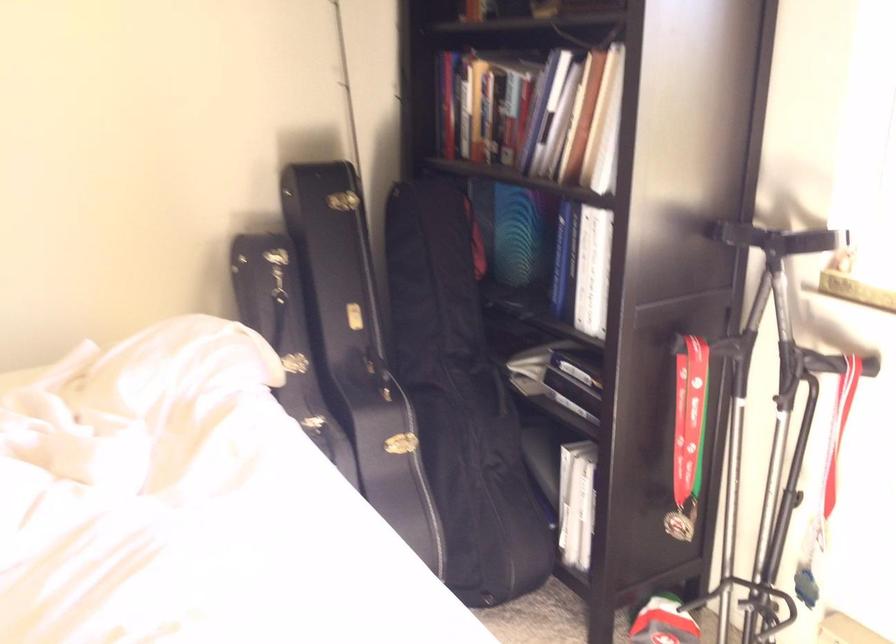
You are a GUI agent. You are given a task and a screenshot of the screen. Output one action in this format:
    pyautogui.click(x=<x>, y=<y>)
    Task: Click on the black soft case
    The image size is (896, 644).
    Given the screenshot: What is the action you would take?
    pyautogui.click(x=460, y=399)